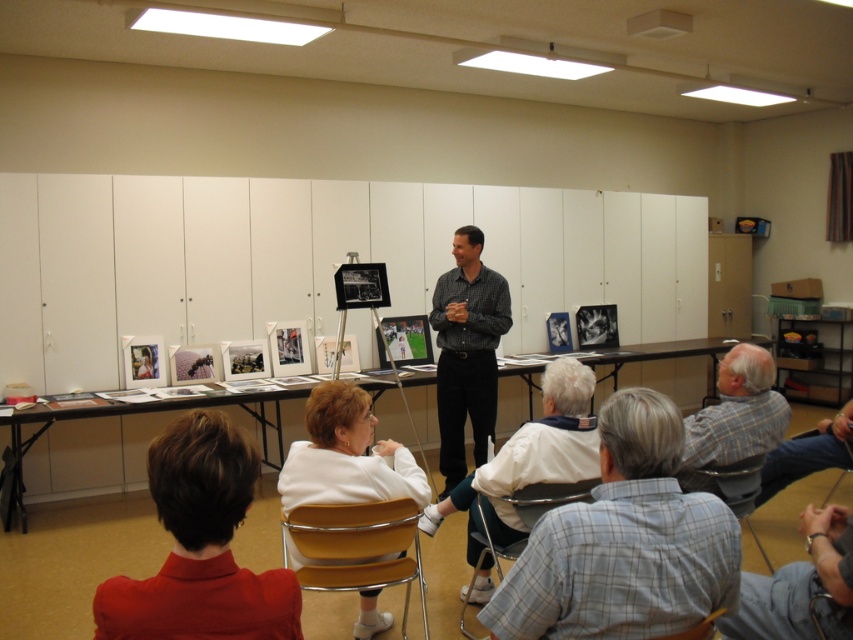
Question: Is checkered fabric shirt at center above metallic silver chair at lower right?

Choices:
 (A) no
 (B) yes

Answer: (B)

Question: Estimate the real-world distances between objects in this image. Which object is closer to the checkered fabric shirt at center?

Choices:
 (A) metallic silver chair at lower center
 (B) yellow plastic chair at lower center
 (C) wooden chair at lower right
 (D) plaid fabric shirt at lower right

Answer: (A)

Question: Which point is closer to the camera taking this photo?

Choices:
 (A) (515, 529)
 (B) (751, 481)
 (C) (310, 582)
 (D) (839, 481)

Answer: (C)

Question: Can you confirm if plaid shirt at lower right is positioned above checkered fabric shirt at center?

Choices:
 (A) yes
 (B) no

Answer: (B)

Question: Considering the relative positions of checkered fabric shirt at center and metallic silver chair at lower right in the image provided, where is checkered fabric shirt at center located with respect to metallic silver chair at lower right?

Choices:
 (A) right
 (B) left

Answer: (B)

Question: Which of the following is the closest to the observer?

Choices:
 (A) (749, 369)
 (B) (474, 422)
 (C) (288, 605)
 (D) (653, 561)

Answer: (C)